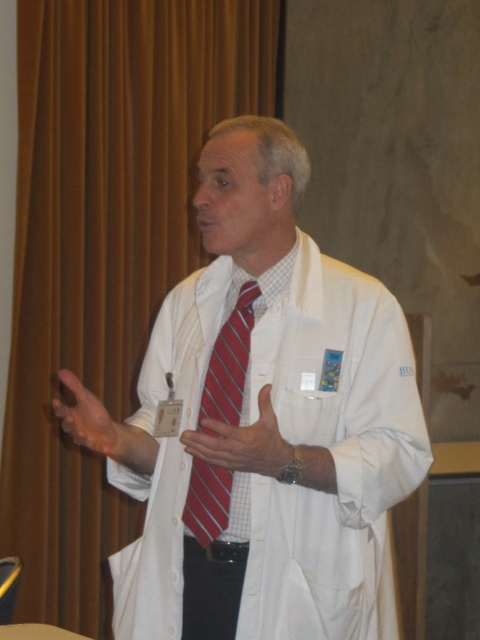
Question: Where is white smooth lab coat at center located in relation to red striped tie at center in the image?

Choices:
 (A) above
 (B) below

Answer: (B)

Question: Based on their relative distances, which object is farther from the white smooth lab coat at center?

Choices:
 (A) matte red tie at center
 (B) brown fabric curtain at left
 (C) matte white hand at lower left

Answer: (B)

Question: Which is farther from the red striped tie at center?

Choices:
 (A) matte white hand at lower left
 (B) matte red tie at center
 (C) white smooth lab coat at center

Answer: (A)

Question: Which point is closer to the camera?

Choices:
 (A) matte white hand at lower left
 (B) red striped tie at center
 (C) white smooth lab coat at center
 (D) brown fabric curtain at left

Answer: (C)

Question: Does red striped tie at center appear over matte white hand at lower left?

Choices:
 (A) no
 (B) yes

Answer: (B)

Question: Is matte red tie at center positioned before matte white hand at lower left?

Choices:
 (A) no
 (B) yes

Answer: (B)